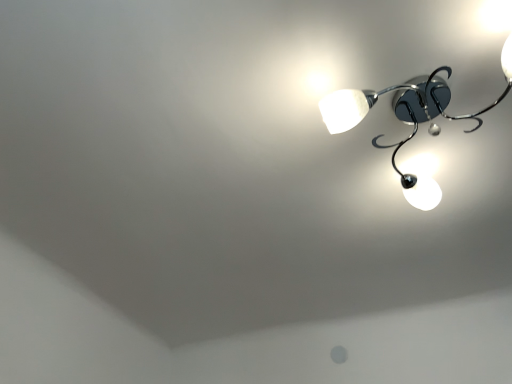
Describe the element at coordinates (408, 117) in the screenshot. This screenshot has height=384, width=512. I see `metallic chrome chandelier at upper right` at that location.

Measure the distance between metallic chrome chandelier at upper right and camera.

The distance of metallic chrome chandelier at upper right from camera is 3.28 feet.

This screenshot has width=512, height=384. What are the coordinates of `metallic chrome chandelier at upper right` in the screenshot? It's located at (408, 117).

In the scene shown: In order to face metallic chrome chandelier at upper right, should I rotate leftwards or rightwards?

You should rotate right by 21.670 degrees.

Image resolution: width=512 pixels, height=384 pixels. What are the coordinates of `metallic chrome chandelier at upper right` in the screenshot? It's located at point(408,117).